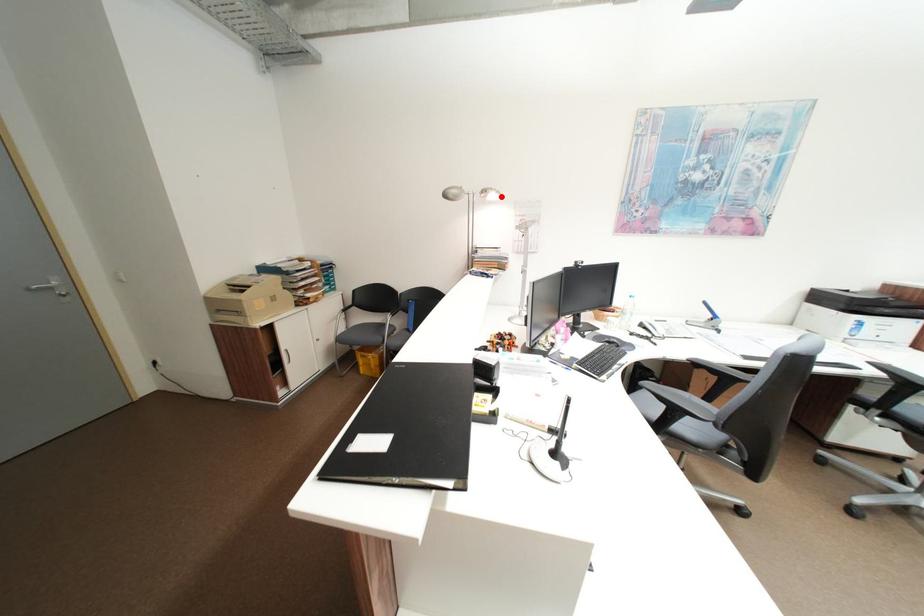
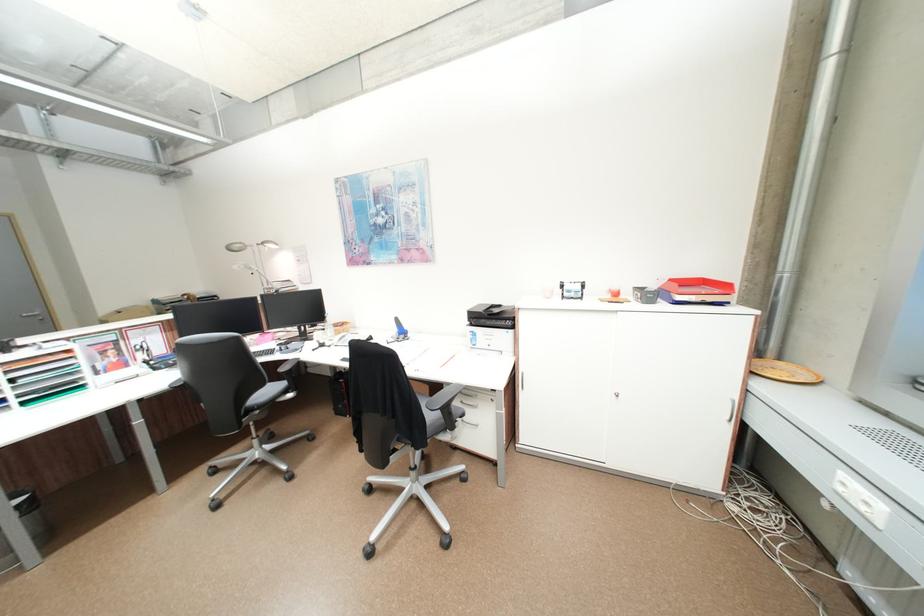
Where in the second image is the point corresponding to the highlighted location from the first image?

(281, 246)